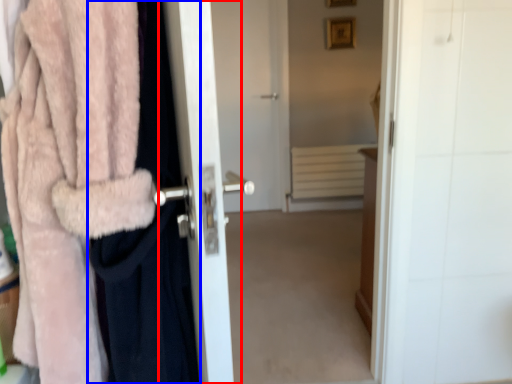
Question: Among these objects, which one is nearest to the camera, screen door (highlighted by a red box) or clothing (highlighted by a blue box)?

Choices:
 (A) screen door
 (B) clothing

Answer: (A)